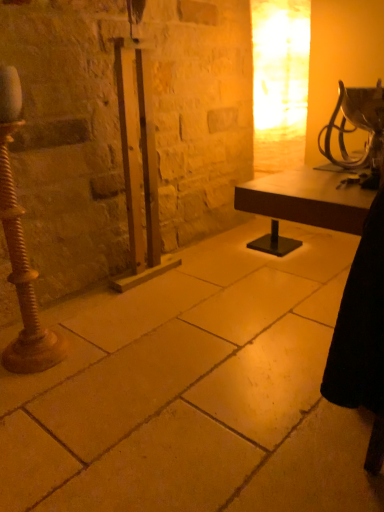
Find the location of a particular element. The width and height of the screenshot is (384, 512). empty space that is ontop of smooth stone floor at center (from a real-world perspective) is located at coordinates (220, 321).